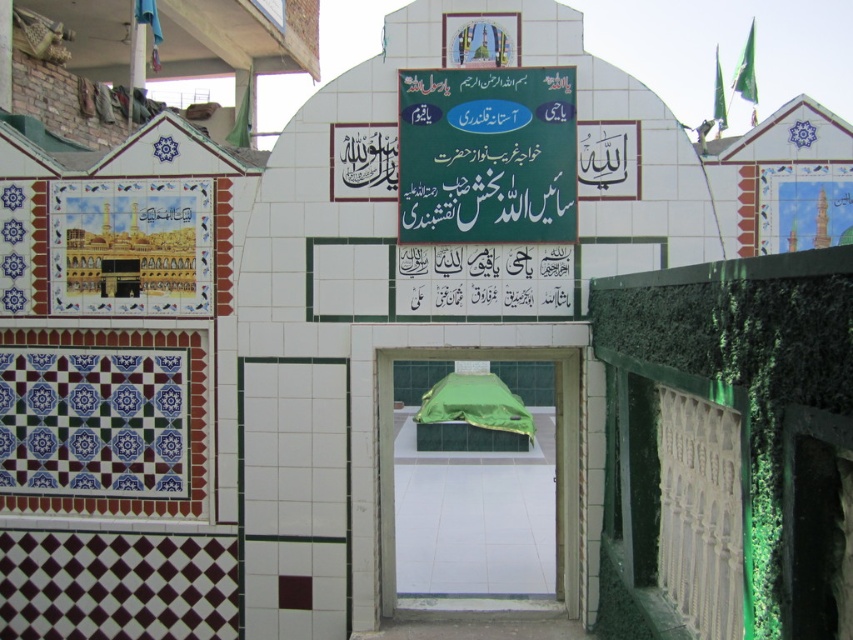
You are standing in front of the religious structure described. You want to locate the green fabric sign at center. Based on its coordinates, where should you look relative to the building?

The green fabric sign at center is located at coordinates point (x=486, y=156), which corresponds to the lower central area of the building.